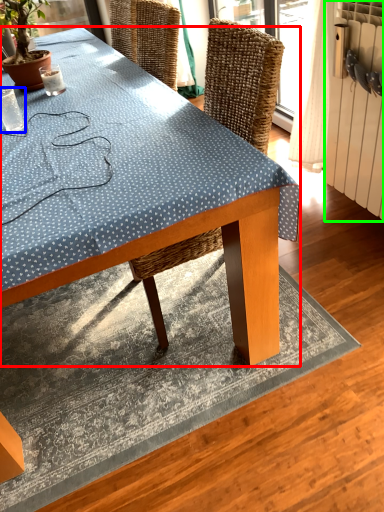
Question: Which object is the closest to the desk (highlighted by a red box)? Choose among these: coffee cup (highlighted by a blue box) or radiator (highlighted by a green box).

Choices:
 (A) coffee cup
 (B) radiator

Answer: (A)